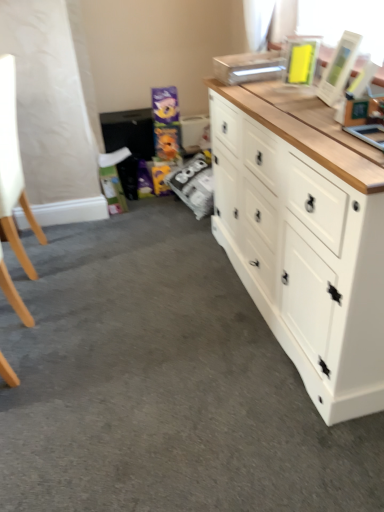
Question: From a real-world perspective, is white leather swivel chair at left physically located above or below white wood chest of drawers at right?

Choices:
 (A) below
 (B) above

Answer: (B)

Question: Is white leather swivel chair at left in front of or behind white wood chest of drawers at right in the image?

Choices:
 (A) front
 (B) behind

Answer: (B)

Question: From the image's perspective, is white leather swivel chair at left positioned above or below white wood chest of drawers at right?

Choices:
 (A) below
 (B) above

Answer: (B)

Question: Looking at their shapes, would you say white wood chest of drawers at right is wider or thinner than white leather swivel chair at left?

Choices:
 (A) wide
 (B) thin

Answer: (A)

Question: From their relative heights in the image, would you say white wood chest of drawers at right is taller or shorter than white leather swivel chair at left?

Choices:
 (A) tall
 (B) short

Answer: (B)

Question: From the image's perspective, is white wood chest of drawers at right positioned above or below white leather swivel chair at left?

Choices:
 (A) above
 (B) below

Answer: (B)

Question: Is white wood chest of drawers at right to the left or to the right of white leather swivel chair at left in the image?

Choices:
 (A) right
 (B) left

Answer: (A)